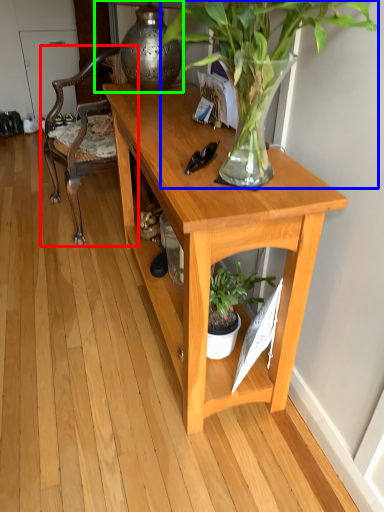
Question: Which object is the farthest from chair (highlighted by a red box)? Choose among these: houseplant (highlighted by a blue box) or lamp (highlighted by a green box).

Choices:
 (A) houseplant
 (B) lamp

Answer: (A)